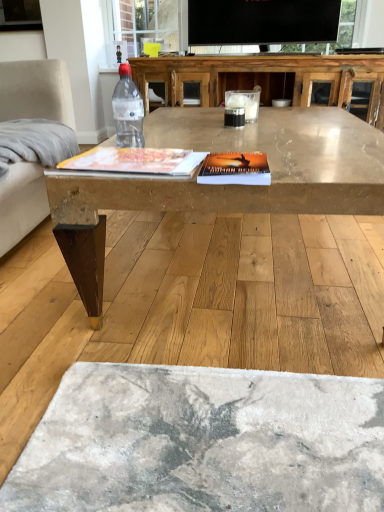
Locate an element on the screen. This screenshot has width=384, height=512. vacant space to the right of transparent plastic bottle at center is located at coordinates (198, 144).